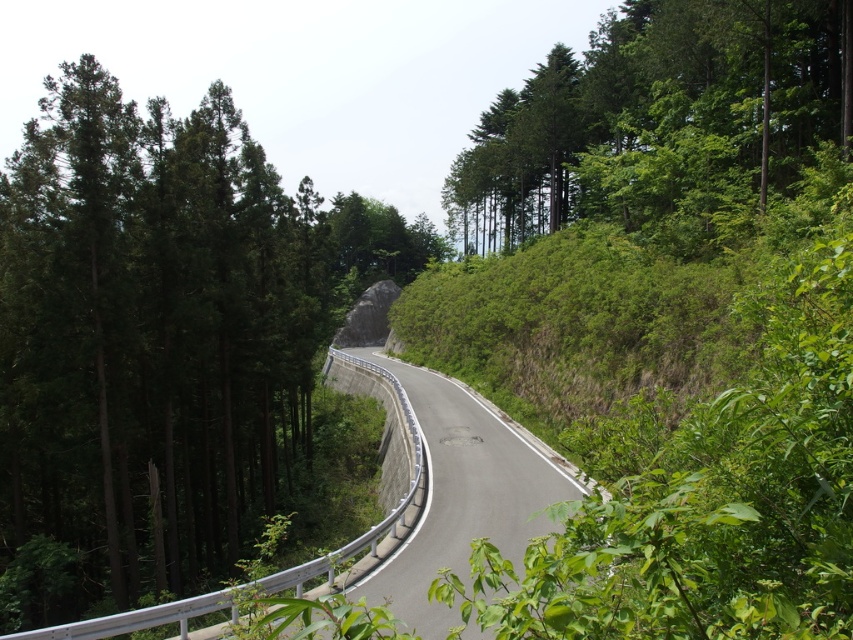
Does green leafy trees at upper right come in front of asphalt road at center?

No, it is behind asphalt road at center.

Who is higher up, green leafy trees at upper right or asphalt road at center?

Positioned higher is green leafy trees at upper right.

Which is in front, point (537, 188) or point (433, 449)?

Point (433, 449) is in front.

This screenshot has width=853, height=640. I want to click on green leafy trees at upper right, so click(659, 120).

Is the position of green matte tree at left more distant than that of asphalt road at center?

A: Yes, it is behind asphalt road at center.

Between point (242, 525) and point (496, 522), which one is positioned behind?

Point (242, 525)

Where is `green matte tree at left`? green matte tree at left is located at coordinates (149, 337).

Is point (123, 100) more distant than point (679, 129)?

Yes, point (123, 100) is behind point (679, 129).

Does point (247, 460) lie behind point (463, 227)?

That is False.

Where is `green matte tree at left`? green matte tree at left is located at coordinates (149, 337).